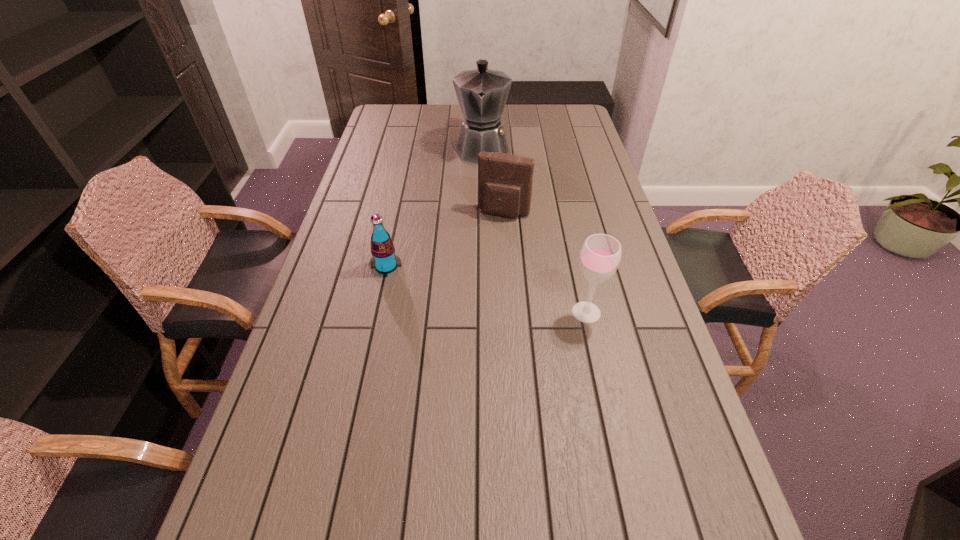
The width and height of the screenshot is (960, 540). Identify the location of blank area located 0.120m at the spout of the coffeepot. (481, 187).

At what (x,y) coordinates should I click in order to perform the action: click on vacant space situated at the spout of the coffeepot. Please return your answer as a coordinate pair (x, y). Looking at the image, I should click on (481, 190).

Locate an element on the screen. vacant region located with an open flap on the pouch is located at coordinates (465, 306).

The width and height of the screenshot is (960, 540). I want to click on free space located 0.180m with an open flap on the pouch, so click(484, 257).

At what (x,y) coordinates should I click in order to perform the action: click on vacant space located with an open flap on the pouch. Please return your answer as a coordinate pair (x, y). Looking at the image, I should click on (464, 308).

Locate an element on the screen. object located in the left edge section of the desktop is located at coordinates (384, 260).

You are a GUI agent. You are given a task and a screenshot of the screen. Output one action in this format:
    pyautogui.click(x=<x>, y=<y>)
    Task: Click on the object at the right edge
    The image size is (960, 540).
    Given the screenshot: What is the action you would take?
    pyautogui.click(x=600, y=256)

This screenshot has height=540, width=960. I want to click on vacant space at the far edge of the desktop, so click(415, 118).

Identify the location of vacant space at the near edge of the desktop. (461, 503).

In the image, there is a desktop. In order to click on vacant space at the left edge in this screenshot , I will do `click(402, 158)`.